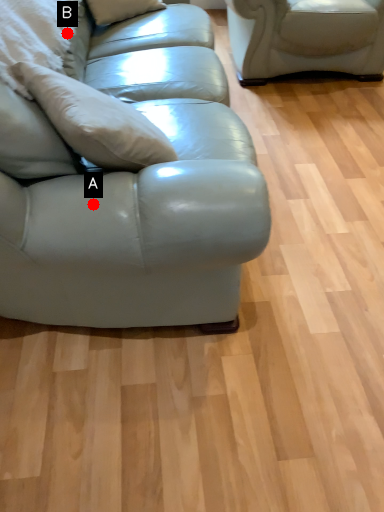
Question: Two points are circled on the image, labeled by A and B beside each circle. Which point is farther to the camera?

Choices:
 (A) A is further
 (B) B is further

Answer: (B)